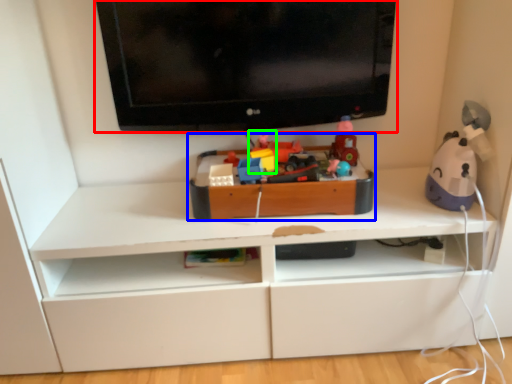
Question: Based on their relative distances, which object is farther from television (highlighted by a red box)? Choose from toy (highlighted by a blue box) and toy (highlighted by a green box).

Choices:
 (A) toy
 (B) toy

Answer: (B)